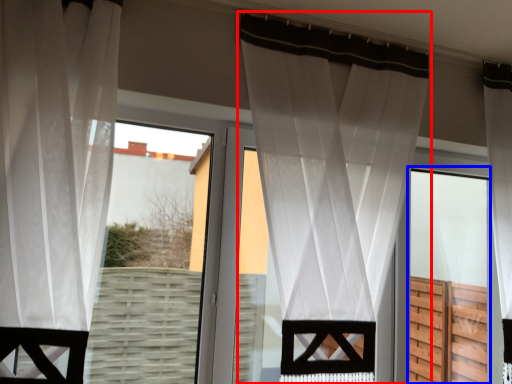
Question: Which object appears closest to the camera in this image, curtain (highlighted by a red box) or screen door (highlighted by a blue box)?

Choices:
 (A) curtain
 (B) screen door

Answer: (A)